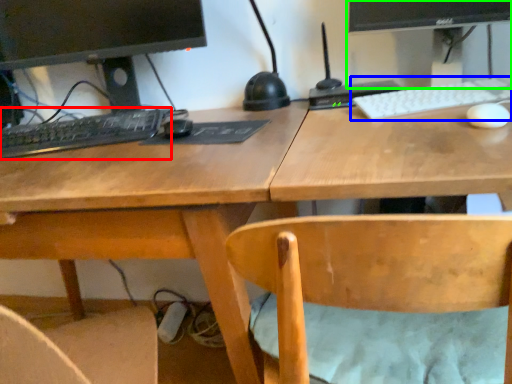
Question: Which is nearer to the computer keyboard (highlighted by a red box)? computer keyboard (highlighted by a blue box) or computer monitor (highlighted by a green box).

Choices:
 (A) computer keyboard
 (B) computer monitor

Answer: (A)